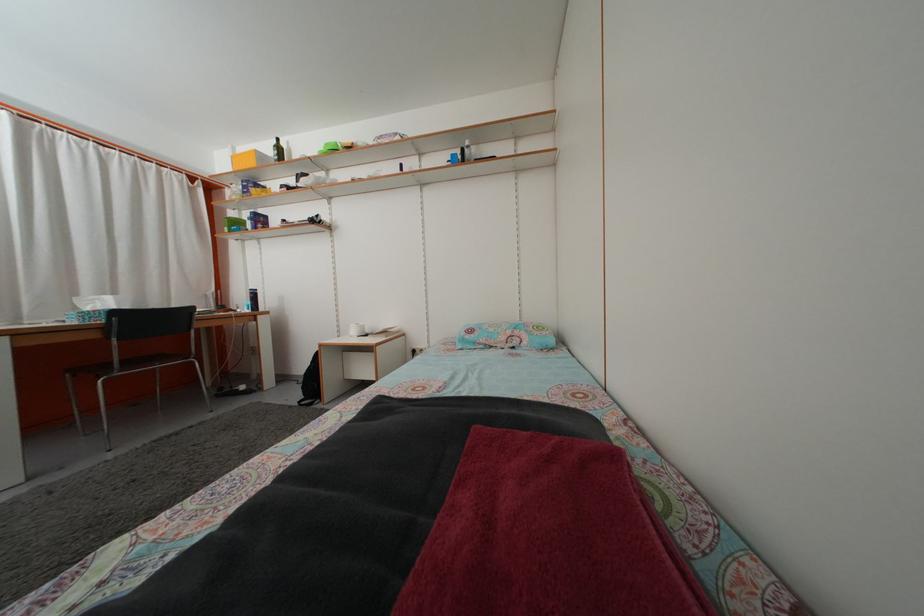
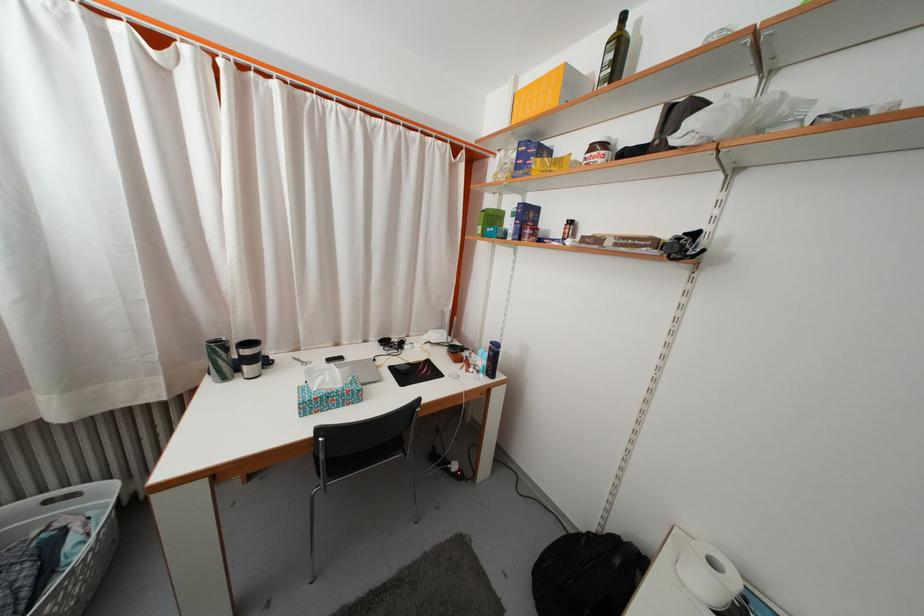
Locate, in the second image, the point that corresponds to point (265, 163) in the first image.

(575, 84)